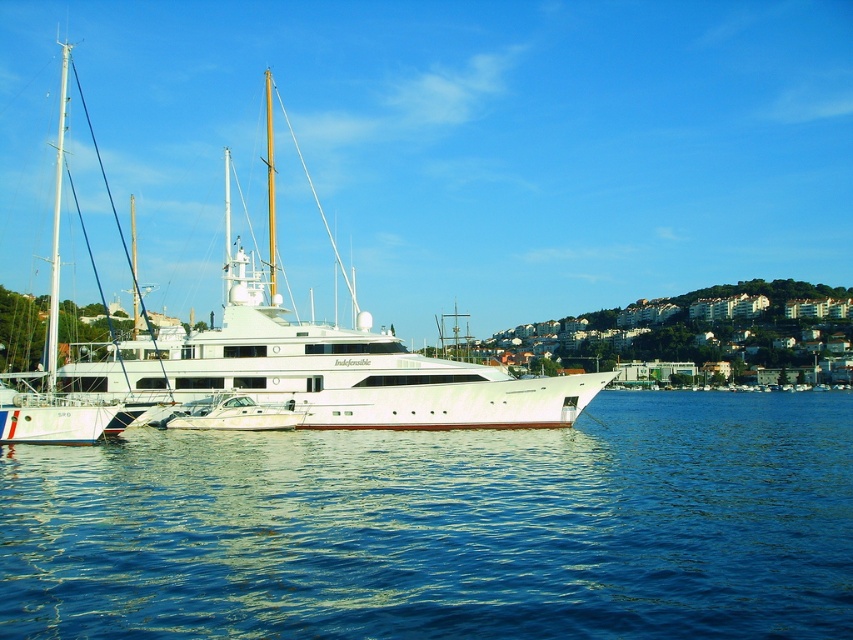
Question: Which is nearer to the white glossy yacht at center?

Choices:
 (A) blue liquid water at lower center
 (B) white matte sailboat at left

Answer: (B)

Question: Which is nearer to the white matte sailboat at left?

Choices:
 (A) blue liquid water at lower center
 (B) white glossy yacht at center

Answer: (B)

Question: Which point is closer to the camera?

Choices:
 (A) (16, 438)
 (B) (285, 483)

Answer: (B)

Question: Does blue liquid water at lower center have a smaller size compared to white glossy yacht at center?

Choices:
 (A) yes
 (B) no

Answer: (A)

Question: Is blue liquid water at lower center behind white matte sailboat at left?

Choices:
 (A) no
 (B) yes

Answer: (A)

Question: Does blue liquid water at lower center appear under white matte sailboat at left?

Choices:
 (A) yes
 (B) no

Answer: (A)